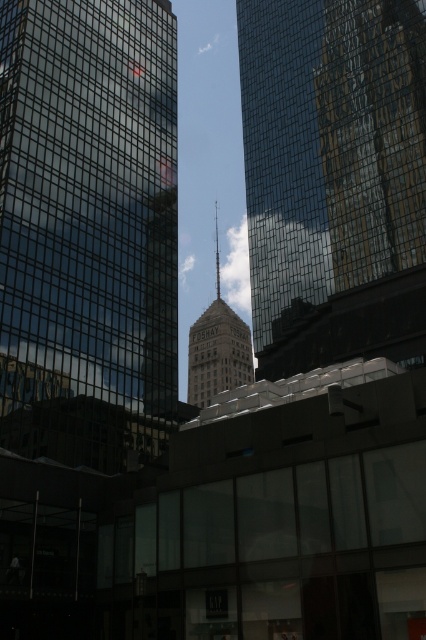
Question: Which of the following is the farthest from the observer?

Choices:
 (A) (209, 348)
 (B) (68, 200)

Answer: (A)

Question: Observing the image, what is the correct spatial positioning of reflective glass skyscraper at center in reference to matte glass tower at center?

Choices:
 (A) right
 (B) left

Answer: (A)

Question: Which object is farther from the camera taking this photo?

Choices:
 (A) reflective glass skyscraper at center
 (B) matte glass tower at center
 (C) transparent glass skyscraper at left

Answer: (B)

Question: Estimate the real-world distances between objects in this image. Which object is closer to the matte glass tower at center?

Choices:
 (A) reflective glass skyscraper at center
 (B) transparent glass skyscraper at left

Answer: (A)

Question: Does transparent glass skyscraper at left appear on the right side of matte glass tower at center?

Choices:
 (A) no
 (B) yes

Answer: (A)

Question: Is transparent glass skyscraper at left wider than matte glass tower at center?

Choices:
 (A) yes
 (B) no

Answer: (B)